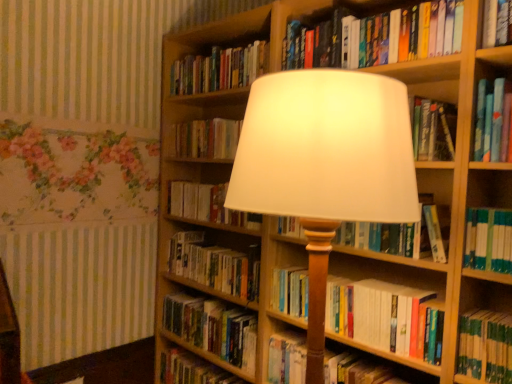
The width and height of the screenshot is (512, 384). What do you see at coordinates (365, 370) in the screenshot?
I see `hardcover book at center, arranged as the ninth book when viewed from the top` at bounding box center [365, 370].

What do you see at coordinates (219, 69) in the screenshot? I see `hardcover book at upper center, which is the first book in top-to-bottom order` at bounding box center [219, 69].

Locate an element on the screen. The image size is (512, 384). hardcover book at upper center, the tenth book ordered from the bottom is located at coordinates (219, 69).

Identify the location of hardcover book at lower center, the 10th book when ordered from top to bottom. The width and height of the screenshot is (512, 384). (191, 370).

Identify the location of wooden bookcase at center. The image size is (512, 384). (445, 201).

Are hardcover book at center, arranged as the third book when viewed from the top, and hardcover book at center, the eighth book from the top, beside each other?

hardcover book at center, arranged as the third book when viewed from the top, and hardcover book at center, the eighth book from the top, are clearly separated.

Which is farther from the camera, (177, 137) or (236, 335)?

The point (177, 137) is farther from the camera.

In the image, is hardcover book at center, which is counted as the eighth book, starting from the bottom, positioned in front of or behind hardcover book at center, the eighth book from the top?

Clearly, hardcover book at center, which is counted as the eighth book, starting from the bottom, is behind hardcover book at center, the eighth book from the top.

Considering the relative sizes of hardcover book at center, which is counted as the eighth book, starting from the bottom, and hardcover book at center, the eighth book from the top, in the image provided, is hardcover book at center, which is counted as the eighth book, starting from the bottom, thinner than hardcover book at center, the eighth book from the top,?

Yes, hardcover book at center, which is counted as the eighth book, starting from the bottom, is thinner than hardcover book at center, the eighth book from the top.

From the image's perspective, which one is positioned higher, hardcover book at upper center, the tenth book ordered from the bottom, or white paper book at center, the 5th book positioned from the top?

hardcover book at upper center, the tenth book ordered from the bottom, appears higher in the image.

Does hardcover book at upper center, the tenth book ordered from the bottom, have a greater width compared to white paper book at center, positioned as the 6th book in bottom-to-top order?

In fact, hardcover book at upper center, the tenth book ordered from the bottom, might be narrower than white paper book at center, positioned as the 6th book in bottom-to-top order.

Find the location of a particular element. This screenshot has height=384, width=512. book that is the 4th one when counting downward from the hardcover book at upper center, the tenth book ordered from the bottom (from the image's perspective) is located at coordinates (402, 234).

From a real-world perspective, who is located higher, hardcover book at center, arranged as the third book when viewed from the top, or hardcover book at lower center, the 10th book when ordered from top to bottom?

hardcover book at center, arranged as the third book when viewed from the top, is physically above.

Is hardcover book at center, arranged as the third book when viewed from the top, positioned with its back to hardcover book at lower center, acting as the 1th book starting from the bottom?

hardcover book at center, arranged as the third book when viewed from the top, does not have its back to hardcover book at lower center, acting as the 1th book starting from the bottom.

Considering their positions, is hardcover book at center, arranged as the third book when viewed from the top, located in front of or behind hardcover book at lower center, the 10th book when ordered from top to bottom?

hardcover book at center, arranged as the third book when viewed from the top, is positioned closer to the viewer than hardcover book at lower center, the 10th book when ordered from top to bottom.

Considering the relative sizes of hardcover book at center, which is counted as the eighth book, starting from the bottom, and hardcover book at lower center, the 10th book when ordered from top to bottom, in the image provided, is hardcover book at center, which is counted as the eighth book, starting from the bottom, bigger than hardcover book at lower center, the 10th book when ordered from top to bottom,?

No.

Is hardcover book at center, the eighth book from the top, shorter than hardcover books at center, which is counted as the seventh book, starting from the top?

No, hardcover book at center, the eighth book from the top, is not shorter than hardcover books at center, which is counted as the seventh book, starting from the top.

Between point (187, 311) and point (416, 344), which one is positioned behind?

The point (187, 311) is behind.

Is hardcover book at center, the eighth book from the top, thinner than hardcover books at center, marked as the fourth book in a bottom-to-top arrangement?

Indeed, hardcover book at center, the eighth book from the top, has a lesser width compared to hardcover books at center, marked as the fourth book in a bottom-to-top arrangement.

Where is `book that is the 1st object above the hardcover book at center, the 3th book from the bottom (from a real-world perspective)`? book that is the 1st object above the hardcover book at center, the 3th book from the bottom (from a real-world perspective) is located at coordinates (385, 317).

Is point (447, 244) closer to viewer compared to point (234, 85)?

Yes.

From a real-world perspective, does white paper book at center, positioned as the 6th book in bottom-to-top order, stand above hardcover book at upper center, the tenth book ordered from the bottom?

No.

Which is correct: white paper book at center, positioned as the 6th book in bottom-to-top order, is inside hardcover book at upper center, which is the first book in top-to-bottom order, or outside of it?

white paper book at center, positioned as the 6th book in bottom-to-top order, is spatially situated outside hardcover book at upper center, which is the first book in top-to-bottom order.

Can you tell me how much white paper book at center, the 5th book positioned from the top, and hardcover book at upper center, the tenth book ordered from the bottom, differ in facing direction?

The angle between the facing direction of white paper book at center, the 5th book positioned from the top, and the facing direction of hardcover book at upper center, the tenth book ordered from the bottom, is 0.000799 degrees.

Is hardcover book at center, arranged as the ninth book when viewed from the top, completely or partially outside of hardcover book at upper center, which is the first book in top-to-bottom order?

Absolutely, hardcover book at center, arranged as the ninth book when viewed from the top, is external to hardcover book at upper center, which is the first book in top-to-bottom order.

Which of these two, hardcover book at center, positioned as the second book in bottom-to-top order, or hardcover book at upper center, the tenth book ordered from the bottom, is smaller?

Smaller between the two is hardcover book at upper center, the tenth book ordered from the bottom.

From the image's perspective, is hardcover book at center, arranged as the ninth book when viewed from the top, below hardcover book at upper center, the tenth book ordered from the bottom?

Correct, hardcover book at center, arranged as the ninth book when viewed from the top, appears lower than hardcover book at upper center, the tenth book ordered from the bottom, in the image.

Which object is closer to the camera, hardcover book at lower center, the 10th book when ordered from top to bottom, or white paper book at center, positioned as the 6th book in bottom-to-top order?

white paper book at center, positioned as the 6th book in bottom-to-top order.

Which of these two, hardcover book at lower center, acting as the 1th book starting from the bottom, or white paper book at center, positioned as the 6th book in bottom-to-top order, stands taller?

hardcover book at lower center, acting as the 1th book starting from the bottom.

In terms of size, does hardcover book at lower center, acting as the 1th book starting from the bottom, appear bigger or smaller than white paper book at center, the 5th book positioned from the top?

Considering their sizes, hardcover book at lower center, acting as the 1th book starting from the bottom, takes up less space than white paper book at center, the 5th book positioned from the top.

Where is `the 5th book above the hardcover book at lower center, the 10th book when ordered from top to bottom (from the image's perspective)`? Image resolution: width=512 pixels, height=384 pixels. the 5th book above the hardcover book at lower center, the 10th book when ordered from top to bottom (from the image's perspective) is located at coordinates (402, 234).

Locate an element on the screen. book that is the 1st one when counting rightward from the hardcover book at center, arranged as the third book when viewed from the top is located at coordinates (213, 328).

Which book is the 3rd one when counting from the front of the hardcover book at upper center, which is the first book in top-to-bottom order? Please provide its 2D coordinates.

[(402, 234)]

Considering their positions, is hardcover book at lower center, acting as the 1th book starting from the bottom, positioned further to wooden bookcase at center than hardcover books at center, which is counted as the seventh book, starting from the top?

hardcover book at lower center, acting as the 1th book starting from the bottom, lies further to wooden bookcase at center than the other object.

Consider the image. Which object lies further to the anchor point hardcover book at center, which is counted as the eighth book, starting from the bottom, wooden bookcase at center or hardcover books at center, marked as the fourth book in a bottom-to-top arrangement?

Among the two, hardcover books at center, marked as the fourth book in a bottom-to-top arrangement, is located further to hardcover book at center, which is counted as the eighth book, starting from the bottom.

Looking at this image, looking at the image, which one is located closer to hardcover book at center, arranged as the ninth book when viewed from the top, hardcover book at center, arranged as the 6th book when viewed from the top, or hardcover book at upper center, which is the ninth book from bottom to top?

Among the two, hardcover book at center, arranged as the 6th book when viewed from the top, is located nearer to hardcover book at center, arranged as the ninth book when viewed from the top.

When comparing their distances from wooden bookcase at center, does hardcover book at upper center, which is the ninth book from bottom to top, or hardcover books at center, marked as the fourth book in a bottom-to-top arrangement, seem further?

hardcover book at upper center, which is the ninth book from bottom to top.

When comparing their distances from hardcover book at upper center, the tenth book ordered from the bottom, does hardcover book at center, positioned as the second book in bottom-to-top order, or hardcover book at center, the eighth book from the top, seem further?

The object further to hardcover book at upper center, the tenth book ordered from the bottom, is hardcover book at center, positioned as the second book in bottom-to-top order.

Based on their spatial positions, is hardcover book at center, arranged as the third book when viewed from the top, or white paper book at center, arranged as the seventh book when ordered from the bottom, further from hardcover book at center, arranged as the 6th book when viewed from the top?

Based on the image, hardcover book at center, arranged as the third book when viewed from the top, appears to be further to hardcover book at center, arranged as the 6th book when viewed from the top.

From the image, which object appears to be farther from hardcover book at lower center, the 10th book when ordered from top to bottom, hardcover book at upper center, the tenth book ordered from the bottom, or hardcover book at center, the eighth book from the top?

hardcover book at upper center, the tenth book ordered from the bottom.

Estimate the real-world distances between objects in this image. Which object is further from white paper book at center, which appears as the fourth book when viewed from the top, hardcover book at center, arranged as the 6th book when viewed from the top, or hardcover book at upper center, which is the ninth book from bottom to top?

Based on the image, hardcover book at upper center, which is the ninth book from bottom to top, appears to be further to white paper book at center, which appears as the fourth book when viewed from the top.

Find the location of a particular element. bookcase between white paper book at center, the 5th book positioned from the top, and hardcover book at center, positioned as the second book in bottom-to-top order, in the up-down direction is located at coordinates tap(445, 201).

Identify the location of bookcase between hardcover book at upper center, which is the first book in top-to-bottom order, and hardcover books at center, which is counted as the seventh book, starting from the top, in the vertical direction. (445, 201).

What are the coordinates of `bookcase between white paper book at center, arranged as the seventh book when ordered from the bottom, and hardcover book at lower center, acting as the 1th book starting from the bottom, in the vertical direction` in the screenshot? It's located at point(445,201).

The height and width of the screenshot is (384, 512). In order to click on bookcase between hardcover book at center, arranged as the third book when viewed from the top, and hardcover book at center, the 3th book from the bottom, from top to bottom in this screenshot , I will do `click(445, 201)`.